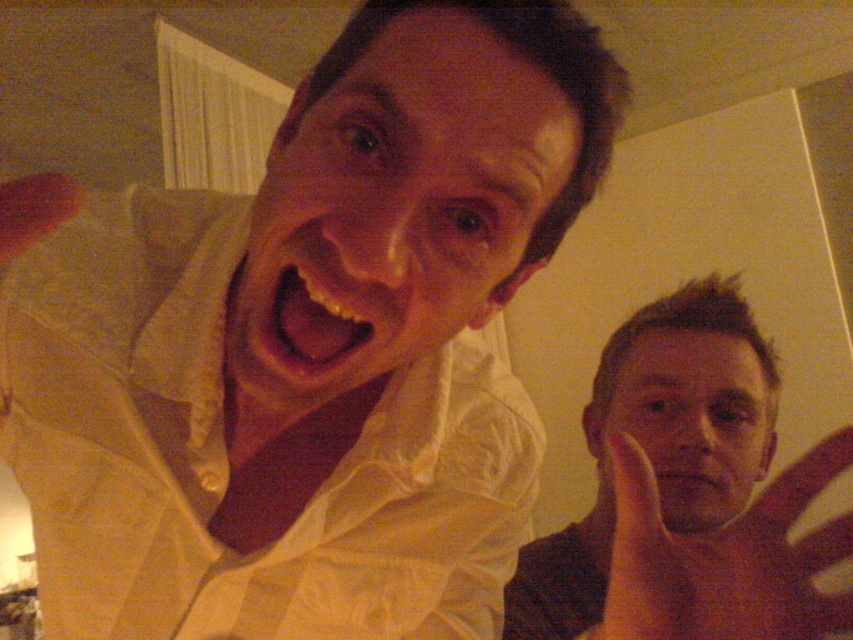
Question: Can you confirm if white glossy shirt at upper left is wider than matte skin hand at lower right?

Choices:
 (A) yes
 (B) no

Answer: (A)

Question: From the image, what is the correct spatial relationship of white glossy shirt at upper left in relation to matte skin hand at lower right?

Choices:
 (A) right
 (B) left

Answer: (B)

Question: Does white glossy shirt at upper left have a greater width compared to matte skin hand at lower right?

Choices:
 (A) yes
 (B) no

Answer: (A)

Question: Which of the following is the farthest from the observer?

Choices:
 (A) matte skin hand at lower right
 (B) white glossy shirt at upper left

Answer: (B)